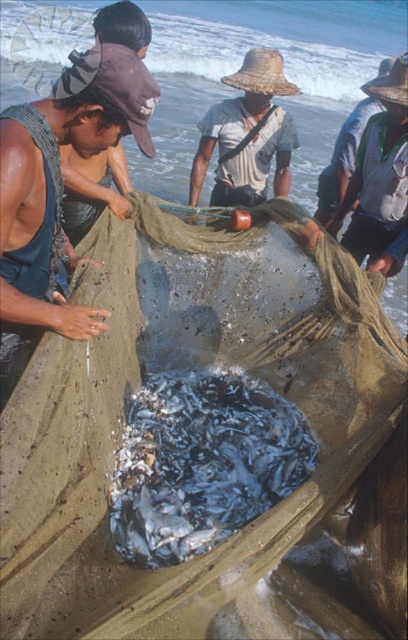
You are standing at the position of the camera and want to pick up the natural straw hat at center. Is the hat within your immediate reach without moving your feet?

The natural straw hat at center and camera are 3.34 meters apart from each other, so the hat is too far to reach without moving your feet. You need to take a few steps forward to grab it.

You are a photographer standing at the beach scene. You want to take a photo of both the matte brown hat at left and the natural straw hat at center. Which hat will appear larger in the photo?

The matte brown hat at left will appear larger in the photo because it is closer to the viewer than the natural straw hat at center.

You are a photographer at the beach scene and want to capture both the matte brown hat at left and the natural straw hat at center in a single frame. Which hat will appear smaller in the photo?

The matte brown hat at left will appear smaller in the photo because it has a smaller size compared to the natural straw hat at center.